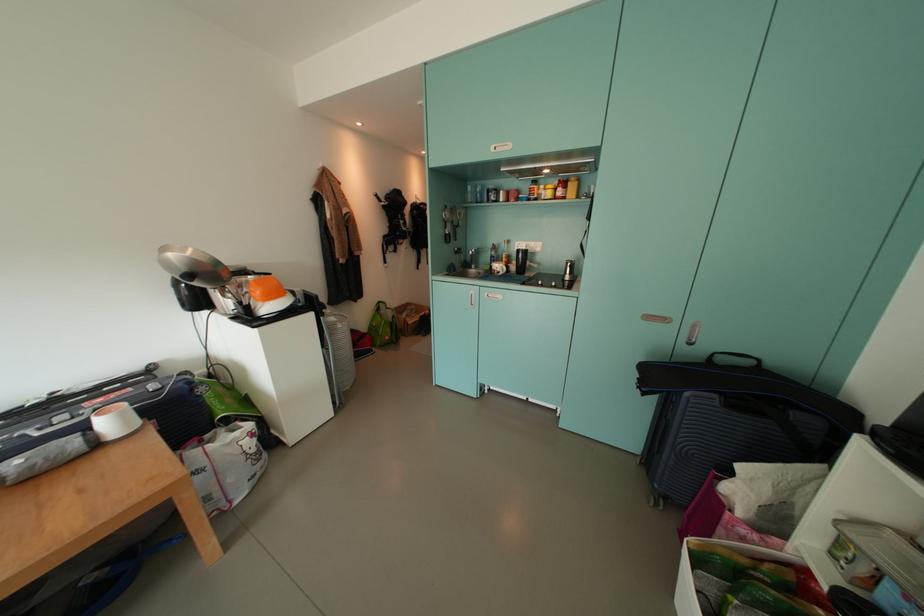
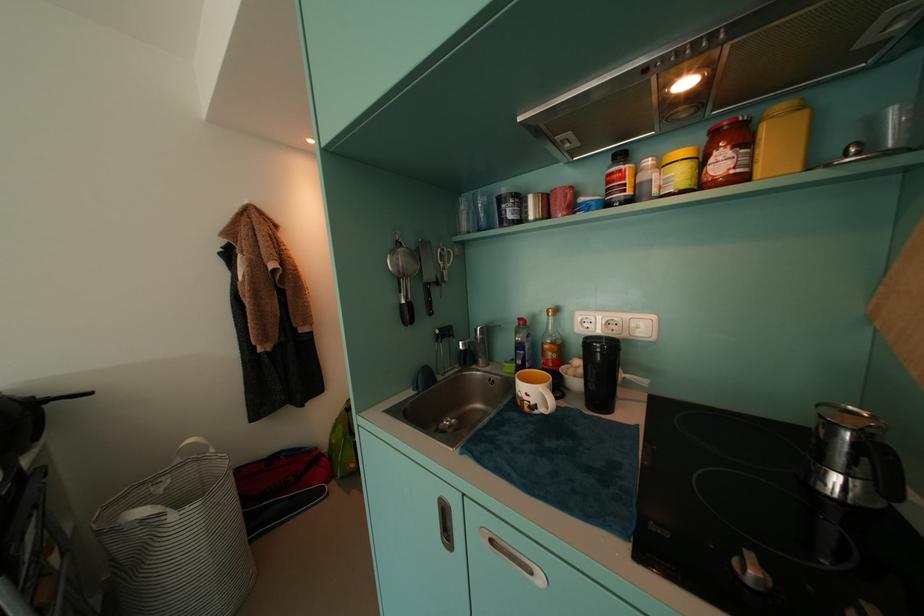
Locate, in the second image, the point that corresponds to pixel 339 322 in the first image.

(149, 516)